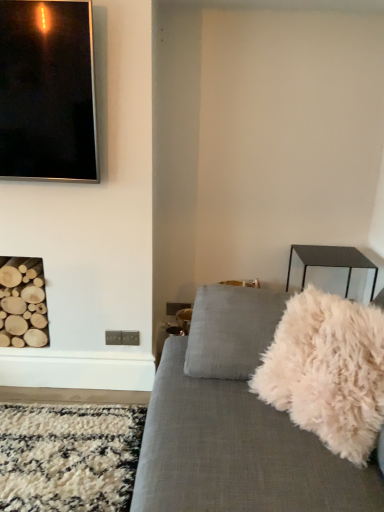
Question: Considering the positions of white fluffy throw pillow at right and black glossy picture frame at upper left in the image, is white fluffy throw pillow at right wider or thinner than black glossy picture frame at upper left?

Choices:
 (A) wide
 (B) thin

Answer: (A)

Question: Considering the positions of white fluffy throw pillow at right and black glossy picture frame at upper left in the image, is white fluffy throw pillow at right taller or shorter than black glossy picture frame at upper left?

Choices:
 (A) short
 (B) tall

Answer: (A)

Question: Is white fluffy throw pillow at right in front of or behind black glossy picture frame at upper left in the image?

Choices:
 (A) front
 (B) behind

Answer: (A)

Question: Considering the positions of black glossy picture frame at upper left and white fluffy throw pillow at right in the image, is black glossy picture frame at upper left bigger or smaller than white fluffy throw pillow at right?

Choices:
 (A) small
 (B) big

Answer: (A)

Question: From the image's perspective, relative to white fluffy throw pillow at right, is black glossy picture frame at upper left above or below?

Choices:
 (A) above
 (B) below

Answer: (A)

Question: Relative to white fluffy throw pillow at right, is black glossy picture frame at upper left in front or behind?

Choices:
 (A) behind
 (B) front

Answer: (A)

Question: Considering the relative positions of black glossy picture frame at upper left and white fluffy throw pillow at right in the image provided, is black glossy picture frame at upper left to the left or to the right of white fluffy throw pillow at right?

Choices:
 (A) right
 (B) left

Answer: (B)